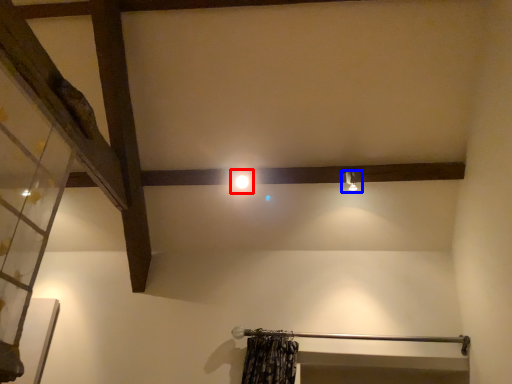
Question: Which point is closer to the camera, light (highlighted by a red box) or light fixture (highlighted by a blue box)?

Choices:
 (A) light
 (B) light fixture

Answer: (B)